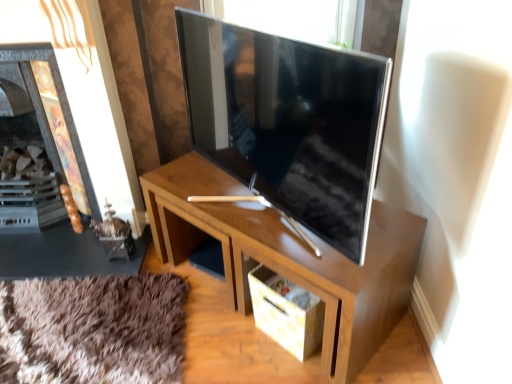
Question: Considering the relative positions of matte cardboard drawer at lower center and satin silver tv at center in the image provided, is matte cardboard drawer at lower center to the left or to the right of satin silver tv at center?

Choices:
 (A) left
 (B) right

Answer: (B)

Question: From a real-world perspective, is matte cardboard drawer at lower center positioned above or below satin silver tv at center?

Choices:
 (A) above
 (B) below

Answer: (B)

Question: Which of these objects is positioned closest to the satin silver tv at center?

Choices:
 (A) wooden desk at center
 (B) wooden fireplace at left
 (C) matte cardboard drawer at lower center

Answer: (A)

Question: Which of these objects is positioned farthest from the wooden fireplace at left?

Choices:
 (A) wooden desk at center
 (B) matte cardboard drawer at lower center
 (C) satin silver tv at center

Answer: (B)